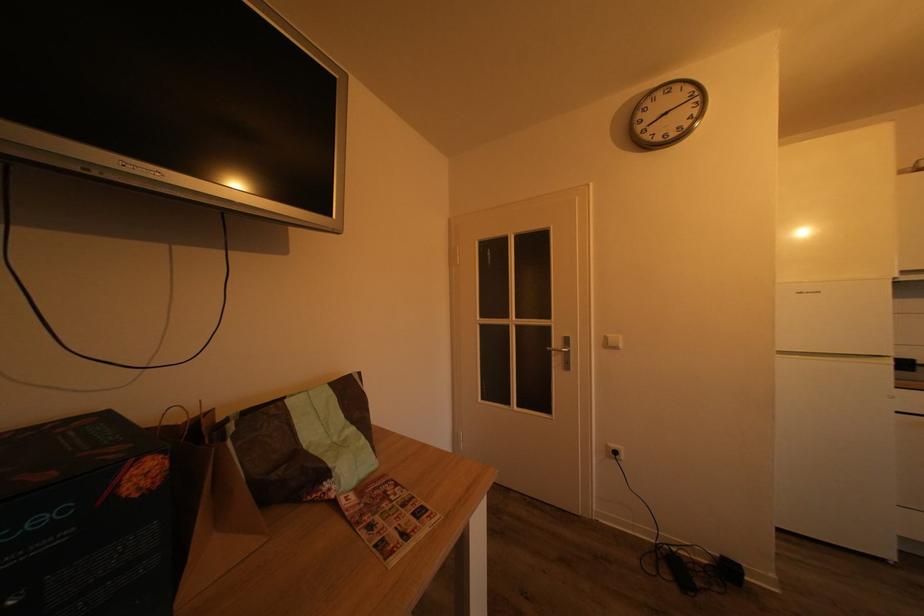
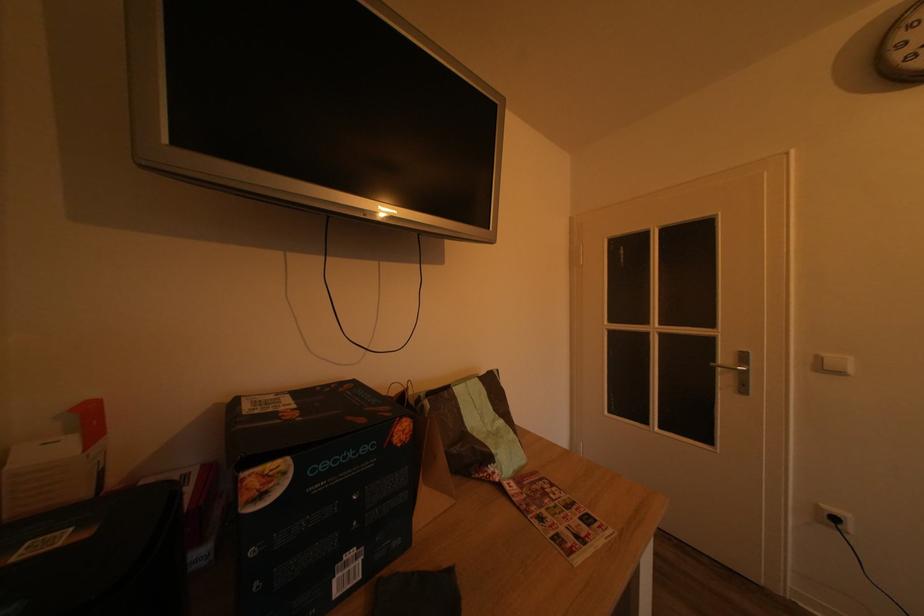
Locate, in the second image, the point that corresponds to (405,491) in the first image.

(560, 491)